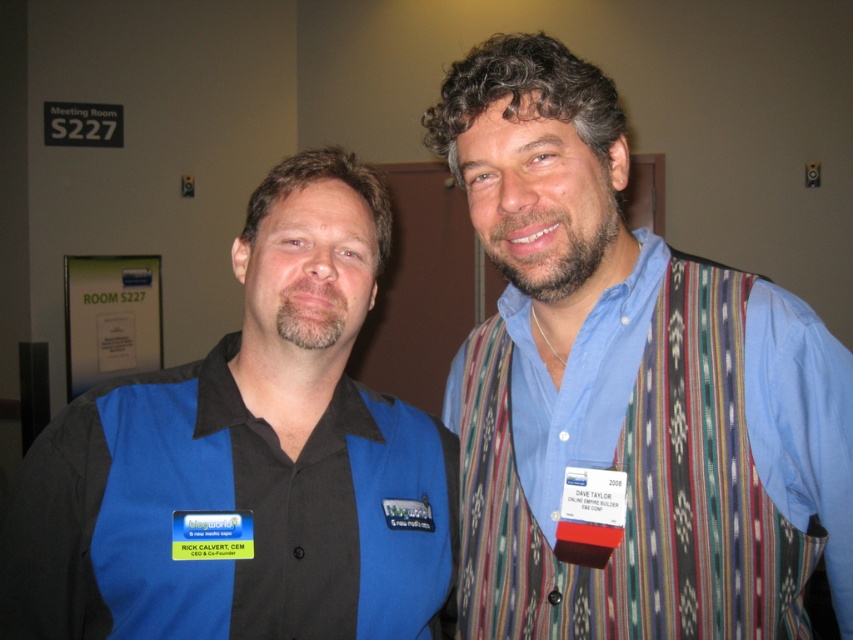
Is blue striped vest at center positioned at the back of black matte shirt at center?

No, blue striped vest at center is in front of black matte shirt at center.

Find the location of a particular element. This screenshot has height=640, width=853. blue striped vest at center is located at coordinates click(x=625, y=388).